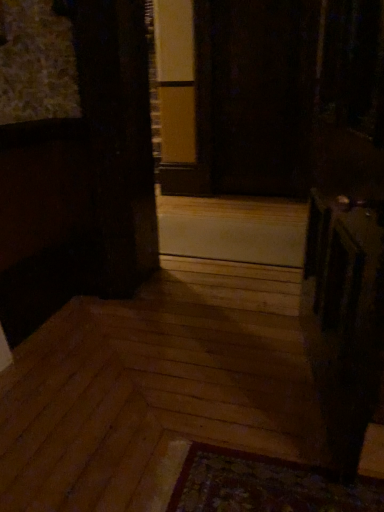
The height and width of the screenshot is (512, 384). What do you see at coordinates (233, 229) in the screenshot?
I see `white matte panel at center` at bounding box center [233, 229].

Find the location of a particular element. The width and height of the screenshot is (384, 512). white matte panel at center is located at coordinates (233, 229).

What is the approximate width of white matte panel at center?

It is 38.54 inches.

The height and width of the screenshot is (512, 384). What do you see at coordinates (255, 95) in the screenshot? I see `transparent glass screen door at center` at bounding box center [255, 95].

At what (x,y) coordinates should I click in order to perform the action: click on transparent glass screen door at center. Please return your answer as a coordinate pair (x, y). The width and height of the screenshot is (384, 512). Looking at the image, I should click on (255, 95).

Identify the location of white matte panel at center. (233, 229).

Which object is positioned more to the left, transparent glass screen door at center or white matte panel at center?

white matte panel at center.

Is transparent glass screen door at center in front of or behind white matte panel at center in the image?

Visually, transparent glass screen door at center is located behind white matte panel at center.

Which point is more forward, (x=313, y=29) or (x=218, y=234)?

The point (x=218, y=234) is closer.

From the image's perspective, between transparent glass screen door at center and white matte panel at center, who is located below?

white matte panel at center, from the image's perspective.

From the picture: From a real-world perspective, which object rests below the other?

white matte panel at center.

Considering the sizes of objects transparent glass screen door at center and white matte panel at center in the image provided, who is wider, transparent glass screen door at center or white matte panel at center?

With larger width is white matte panel at center.

Is transparent glass screen door at center taller than white matte panel at center?

Correct, transparent glass screen door at center is much taller as white matte panel at center.

Between transparent glass screen door at center and white matte panel at center, which one has larger size?

Bigger between the two is transparent glass screen door at center.

Could white matte panel at center be considered to be inside transparent glass screen door at center?

Actually, white matte panel at center is outside transparent glass screen door at center.

Is transparent glass screen door at center not close to white matte panel at center?

transparent glass screen door at center is actually quite close to white matte panel at center.

Based on the photo, is transparent glass screen door at center looking in the opposite direction of white matte panel at center?

No, transparent glass screen door at center's orientation is not away from white matte panel at center.

This screenshot has height=512, width=384. What are the coordinates of `screen door above the white matte panel at center (from a real-world perspective)` in the screenshot? It's located at (255, 95).

Considering the positions of objects white matte panel at center and transparent glass screen door at center in the image provided, who is more to the left, white matte panel at center or transparent glass screen door at center?

white matte panel at center is more to the left.

Which object is closer to the camera taking this photo, white matte panel at center or transparent glass screen door at center?

white matte panel at center is in front.

Which is in front, point (258, 209) or point (281, 145)?

The point (258, 209) is closer.

From the image's perspective, which is below, white matte panel at center or transparent glass screen door at center?

white matte panel at center.

From a real-world perspective, is white matte panel at center under transparent glass screen door at center?

Yes, from a real-world perspective, white matte panel at center is beneath transparent glass screen door at center.

Can you confirm if white matte panel at center is thinner than transparent glass screen door at center?

In fact, white matte panel at center might be wider than transparent glass screen door at center.

From the picture: Between white matte panel at center and transparent glass screen door at center, which one has more height?

transparent glass screen door at center.

In the scene shown: Can you confirm if white matte panel at center is smaller than transparent glass screen door at center?

Yes, white matte panel at center is smaller than transparent glass screen door at center.

Is white matte panel at center situated inside transparent glass screen door at center or outside?

white matte panel at center is not inside transparent glass screen door at center, it's outside.

Is there a large distance between white matte panel at center and transparent glass screen door at center?

No.

Is white matte panel at center oriented towards transparent glass screen door at center?

No.

How different are the orientations of white matte panel at center and transparent glass screen door at center in degrees?

The angular difference between white matte panel at center and transparent glass screen door at center is 0.513 degrees.

Identify the location of stairwell that appears below the transparent glass screen door at center (from the image's perspective). Image resolution: width=384 pixels, height=512 pixels. (233, 229).

You are a GUI agent. You are given a task and a screenshot of the screen. Output one action in this format:
    pyautogui.click(x=<x>, y=<y>)
    Task: Click on the stairwell lying on the left of transparent glass screen door at center
    
    Given the screenshot: What is the action you would take?
    pyautogui.click(x=233, y=229)

Where is `screen door above the white matte panel at center (from a real-world perspective)`? The width and height of the screenshot is (384, 512). screen door above the white matte panel at center (from a real-world perspective) is located at coordinates (255, 95).